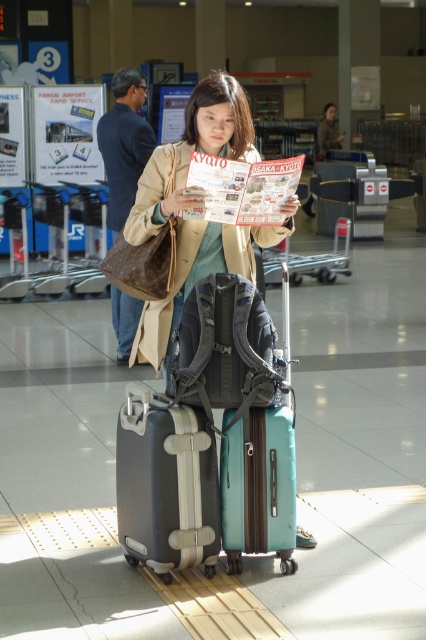
Question: Can you confirm if matte black suitcase at center is positioned above teal matte suitcase at center?

Choices:
 (A) no
 (B) yes

Answer: (B)

Question: Does teal matte suitcase at center appear on the right side of printed paper magazine at center?

Choices:
 (A) yes
 (B) no

Answer: (A)

Question: Which object appears closest to the camera in this image?

Choices:
 (A) teal matte suitcase at center
 (B) printed paper magazine at center

Answer: (B)

Question: Which point appears farthest from the camera in this image?

Choices:
 (A) (276, 442)
 (B) (141, 342)
 (C) (164, 540)

Answer: (B)

Question: Is matte beige coat at center smaller than matte black suitcase at center?

Choices:
 (A) no
 (B) yes

Answer: (A)

Question: Based on their relative distances, which object is farther from the matte beige coat at center?

Choices:
 (A) matte black suitcase at center
 (B) printed paper magazine at center

Answer: (A)